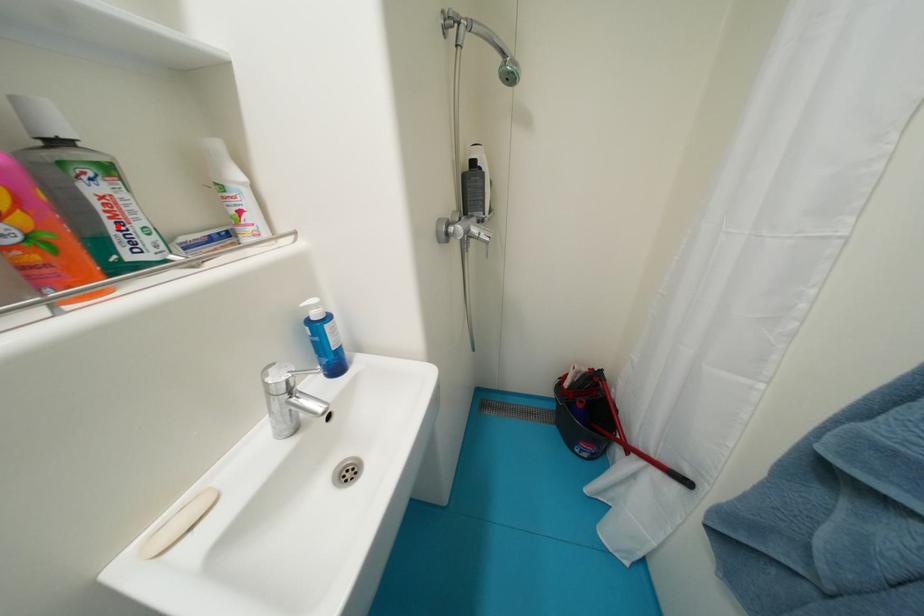
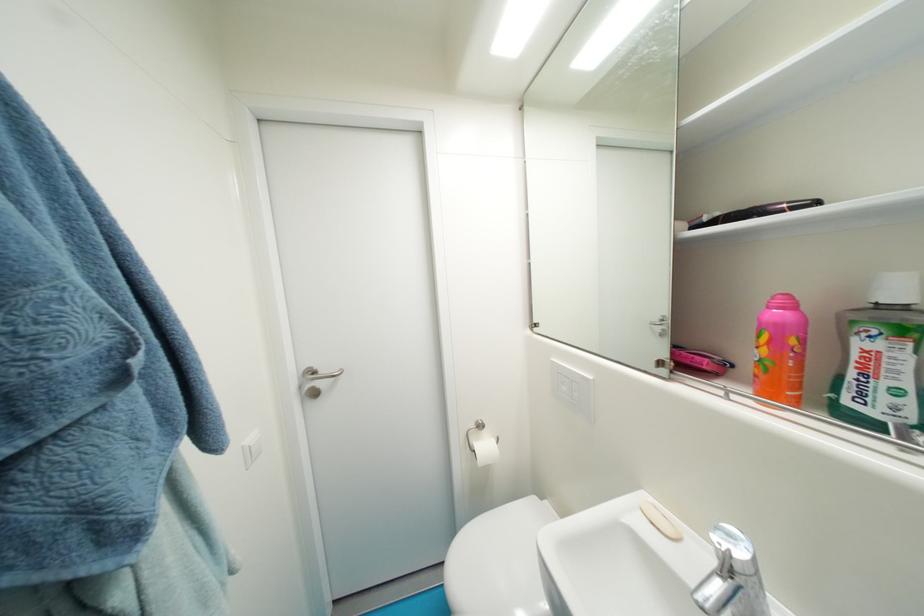
Where in the second image is the point corresponding to the highlighted location from the first image?

(858, 376)